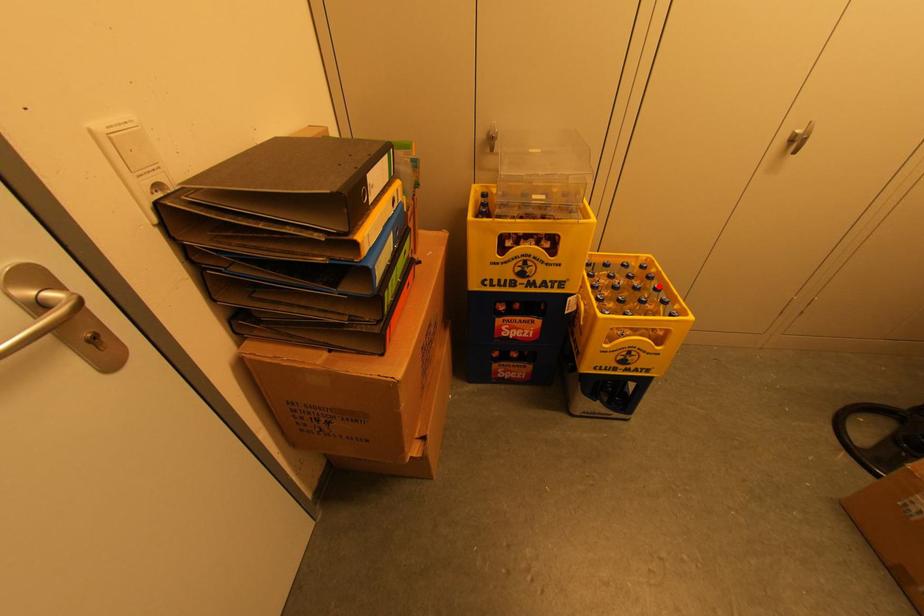
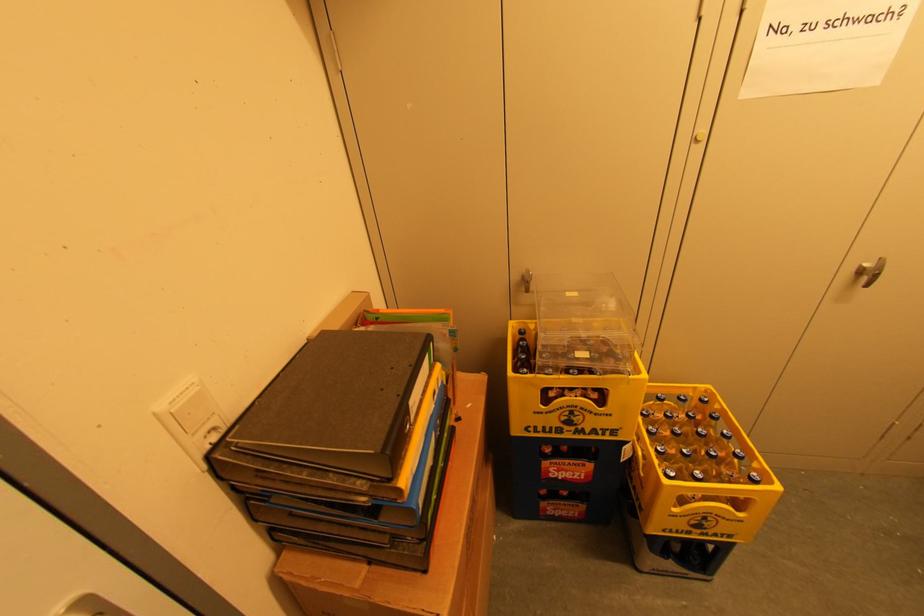
Locate, in the second image, the point that corresponds to the highlighted location in the first image.

(726, 432)